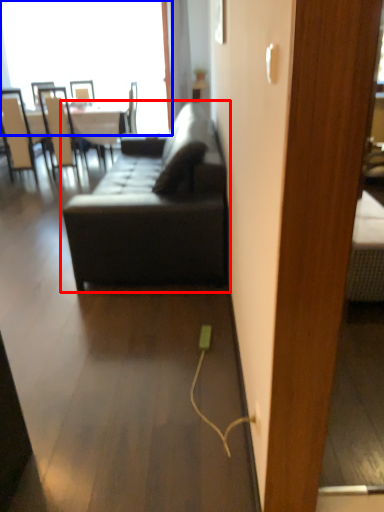
Question: Which of the following is the farthest to the observer, studio couch (highlighted by a red box) or window (highlighted by a blue box)?

Choices:
 (A) studio couch
 (B) window

Answer: (B)